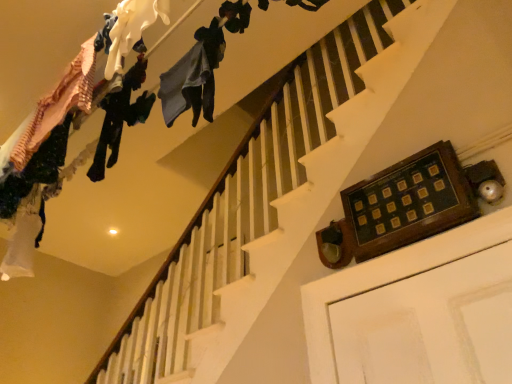
The height and width of the screenshot is (384, 512). What do you see at coordinates (205, 70) in the screenshot?
I see `dark blue fabric at upper center, the 3th clothing viewed from the left` at bounding box center [205, 70].

I want to click on dark blue fabric at upper center, the 3th clothing viewed from the left, so click(205, 70).

This screenshot has height=384, width=512. Identify the location of matte white fabric at upper left, positioned as the 2th clothing in right-to-left order. (132, 28).

The image size is (512, 384). I want to click on dark blue fabric at upper center, the 3th clothing viewed from the left, so click(x=205, y=70).

Considering the relative positions of dark blue fabric at upper center, the 3th clothing viewed from the left, and matte white fabric at upper left, positioned as the 2th clothing in right-to-left order, in the image provided, is dark blue fabric at upper center, the 3th clothing viewed from the left, in front of matte white fabric at upper left, positioned as the 2th clothing in right-to-left order,?

No, dark blue fabric at upper center, the 3th clothing viewed from the left, is behind matte white fabric at upper left, positioned as the 2th clothing in right-to-left order.

Which is behind, point (217, 28) or point (121, 4)?

The point (217, 28) is more distant.

Are dark blue fabric at upper center, the first clothing when ordered from right to left, and matte white fabric at upper left, arranged as the second clothing when viewed from the left, beside each other?

dark blue fabric at upper center, the first clothing when ordered from right to left, is not next to matte white fabric at upper left, arranged as the second clothing when viewed from the left, and they're not touching.

Can you confirm if dark blue fabric at upper center, the first clothing when ordered from right to left, is smaller than matte white fabric at upper left, positioned as the 2th clothing in right-to-left order?

Actually, dark blue fabric at upper center, the first clothing when ordered from right to left, might be larger than matte white fabric at upper left, positioned as the 2th clothing in right-to-left order.

From the image's perspective, is dark blue fabric at upper center, the first clothing when ordered from right to left, positioned above or below dark green fabric pants at upper left, which is the first clothing in left-to-right order?

Clearly, from the image's perspective, dark blue fabric at upper center, the first clothing when ordered from right to left, is above dark green fabric pants at upper left, which is the first clothing in left-to-right order.

Between dark blue fabric at upper center, the 3th clothing viewed from the left, and dark green fabric pants at upper left, which is the first clothing in left-to-right order, which one has larger size?

dark green fabric pants at upper left, which is the first clothing in left-to-right order.

Can you see dark blue fabric at upper center, the first clothing when ordered from right to left, touching dark green fabric pants at upper left, which is counted as the third clothing, starting from the right?

There is a gap between dark blue fabric at upper center, the first clothing when ordered from right to left, and dark green fabric pants at upper left, which is counted as the third clothing, starting from the right.

How many degrees apart are the facing directions of dark blue fabric at upper center, the first clothing when ordered from right to left, and dark green fabric pants at upper left, which is counted as the third clothing, starting from the right?

The angular difference between dark blue fabric at upper center, the first clothing when ordered from right to left, and dark green fabric pants at upper left, which is counted as the third clothing, starting from the right, is 0.000823 degrees.

Could you measure the distance between matte white fabric at upper left, positioned as the 2th clothing in right-to-left order, and dark green fabric pants at upper left, which is the first clothing in left-to-right order?

matte white fabric at upper left, positioned as the 2th clothing in right-to-left order, and dark green fabric pants at upper left, which is the first clothing in left-to-right order, are 14.14 inches apart.

In the scene shown: Which is less distant, [125,31] or [99,167]?

Positioned in front is point [125,31].

From the image's perspective, which is above, matte white fabric at upper left, arranged as the second clothing when viewed from the left, or dark green fabric pants at upper left, which is the first clothing in left-to-right order?

From the image's view, matte white fabric at upper left, arranged as the second clothing when viewed from the left, is above.

Between matte white fabric at upper left, arranged as the second clothing when viewed from the left, and dark green fabric pants at upper left, which is counted as the third clothing, starting from the right, which one appears on the right side from the viewer's perspective?

matte white fabric at upper left, arranged as the second clothing when viewed from the left.

Is matte white fabric at upper left, arranged as the second clothing when viewed from the left, closer to the viewer compared to dark blue fabric at upper center, the 3th clothing viewed from the left?

Yes, it is.

Find the location of a particular element. the 1st clothing below when counting from the matte white fabric at upper left, positioned as the 2th clothing in right-to-left order (from the image's perspective) is located at coordinates (205, 70).

Is matte white fabric at upper left, positioned as the 2th clothing in right-to-left order, facing towards dark blue fabric at upper center, the first clothing when ordered from right to left?

No, matte white fabric at upper left, positioned as the 2th clothing in right-to-left order, is not turned towards dark blue fabric at upper center, the first clothing when ordered from right to left.

How many degrees apart are the facing directions of matte white fabric at upper left, arranged as the second clothing when viewed from the left, and dark blue fabric at upper center, the first clothing when ordered from right to left?

0.302 degrees.

Measure the distance from dark green fabric pants at upper left, which is the first clothing in left-to-right order, to dark blue fabric at upper center, the first clothing when ordered from right to left.

dark green fabric pants at upper left, which is the first clothing in left-to-right order, is 14.87 inches from dark blue fabric at upper center, the first clothing when ordered from right to left.

Does dark green fabric pants at upper left, which is the first clothing in left-to-right order, have a lesser height compared to dark blue fabric at upper center, the first clothing when ordered from right to left?

No.

Considering their positions, is dark green fabric pants at upper left, which is counted as the third clothing, starting from the right, located in front of or behind dark blue fabric at upper center, the first clothing when ordered from right to left?

Visually, dark green fabric pants at upper left, which is counted as the third clothing, starting from the right, is located behind dark blue fabric at upper center, the first clothing when ordered from right to left.

In terms of width, does dark green fabric pants at upper left, which is the first clothing in left-to-right order, look wider or thinner when compared to dark blue fabric at upper center, the first clothing when ordered from right to left?

dark green fabric pants at upper left, which is the first clothing in left-to-right order, is wider than dark blue fabric at upper center, the first clothing when ordered from right to left.

Which object is positioned more to the right, dark green fabric pants at upper left, which is the first clothing in left-to-right order, or matte white fabric at upper left, positioned as the 2th clothing in right-to-left order?

matte white fabric at upper left, positioned as the 2th clothing in right-to-left order.

Considering the sizes of dark green fabric pants at upper left, which is counted as the third clothing, starting from the right, and matte white fabric at upper left, arranged as the second clothing when viewed from the left, in the image, is dark green fabric pants at upper left, which is counted as the third clothing, starting from the right, bigger or smaller than matte white fabric at upper left, arranged as the second clothing when viewed from the left,?

In the image, dark green fabric pants at upper left, which is counted as the third clothing, starting from the right, appears to be larger than matte white fabric at upper left, arranged as the second clothing when viewed from the left.

Between dark green fabric pants at upper left, which is counted as the third clothing, starting from the right, and matte white fabric at upper left, arranged as the second clothing when viewed from the left, which one has more height?

dark green fabric pants at upper left, which is counted as the third clothing, starting from the right.

Locate an element on the screen. The height and width of the screenshot is (384, 512). clothing above the dark blue fabric at upper center, the 3th clothing viewed from the left (from the image's perspective) is located at coordinates (132, 28).

Where is `clothing that appears below the dark blue fabric at upper center, the first clothing when ordered from right to left (from the image's perspective)`? The height and width of the screenshot is (384, 512). clothing that appears below the dark blue fabric at upper center, the first clothing when ordered from right to left (from the image's perspective) is located at coordinates (120, 117).

Which object lies further to the anchor point dark green fabric pants at upper left, which is counted as the third clothing, starting from the right, dark blue fabric at upper center, the first clothing when ordered from right to left, or matte white fabric at upper left, arranged as the second clothing when viewed from the left?

Among the two, dark blue fabric at upper center, the first clothing when ordered from right to left, is located further to dark green fabric pants at upper left, which is counted as the third clothing, starting from the right.

Looking at the image, which one is located closer to dark green fabric pants at upper left, which is counted as the third clothing, starting from the right, matte white fabric at upper left, arranged as the second clothing when viewed from the left, or dark blue fabric at upper center, the first clothing when ordered from right to left?

The object closer to dark green fabric pants at upper left, which is counted as the third clothing, starting from the right, is matte white fabric at upper left, arranged as the second clothing when viewed from the left.

Looking at the image, which one is located further to dark blue fabric at upper center, the 3th clothing viewed from the left, dark green fabric pants at upper left, which is counted as the third clothing, starting from the right, or matte white fabric at upper left, positioned as the 2th clothing in right-to-left order?

dark green fabric pants at upper left, which is counted as the third clothing, starting from the right, is further to dark blue fabric at upper center, the 3th clothing viewed from the left.

Considering their positions, is dark green fabric pants at upper left, which is counted as the third clothing, starting from the right, positioned further to matte white fabric at upper left, arranged as the second clothing when viewed from the left, than dark blue fabric at upper center, the 3th clothing viewed from the left?

dark green fabric pants at upper left, which is counted as the third clothing, starting from the right.

In the scene shown: Estimate the real-world distances between objects in this image. Which object is closer to dark blue fabric at upper center, the first clothing when ordered from right to left, matte white fabric at upper left, positioned as the 2th clothing in right-to-left order, or dark green fabric pants at upper left, which is the first clothing in left-to-right order?

matte white fabric at upper left, positioned as the 2th clothing in right-to-left order, is closer to dark blue fabric at upper center, the first clothing when ordered from right to left.

Estimate the real-world distances between objects in this image. Which object is closer to matte white fabric at upper left, arranged as the second clothing when viewed from the left, dark blue fabric at upper center, the 3th clothing viewed from the left, or dark green fabric pants at upper left, which is counted as the third clothing, starting from the right?

dark blue fabric at upper center, the 3th clothing viewed from the left, is positioned closer to the anchor matte white fabric at upper left, arranged as the second clothing when viewed from the left.

In order to click on clothing between dark green fabric pants at upper left, which is counted as the third clothing, starting from the right, and dark blue fabric at upper center, the first clothing when ordered from right to left in this screenshot , I will do `click(132, 28)`.